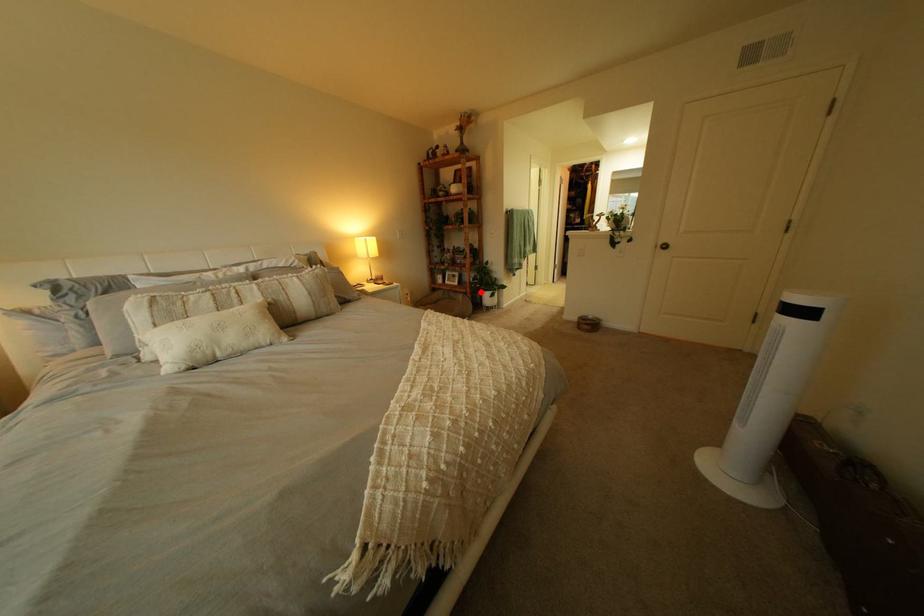
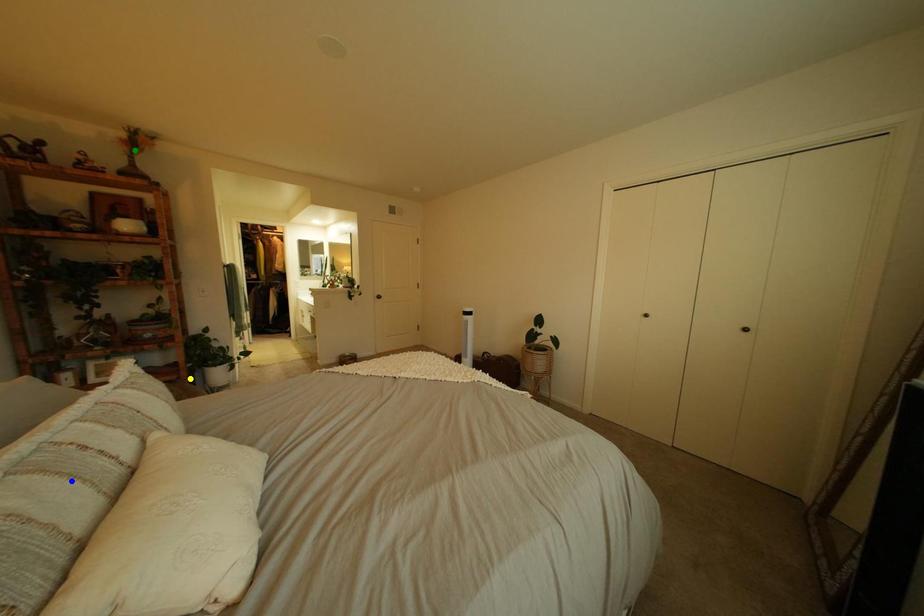
Question: I am providing you with two images of the same scene from different viewpoints. A red point is marked on the first image. You are given multiple points on the second image. Which spot in image 2 lines up with the point in image 1?

Choices:
 (A) green point
 (B) blue point
 (C) yellow point

Answer: (C)